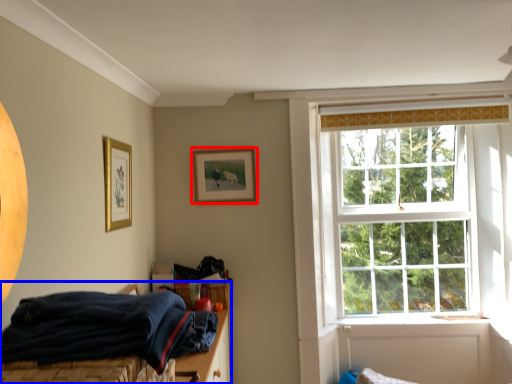
Question: Which object is further to the camera taking this photo, picture frame (highlighted by a red box) or bed (highlighted by a blue box)?

Choices:
 (A) picture frame
 (B) bed

Answer: (A)